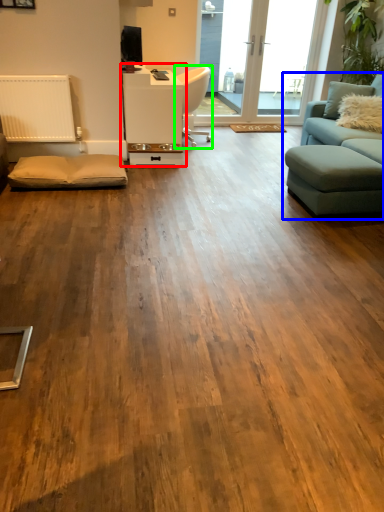
Question: Which object is the closest to the table (highlighted by a red box)? Choose among these: studio couch (highlighted by a blue box) or chair (highlighted by a green box).

Choices:
 (A) studio couch
 (B) chair

Answer: (B)